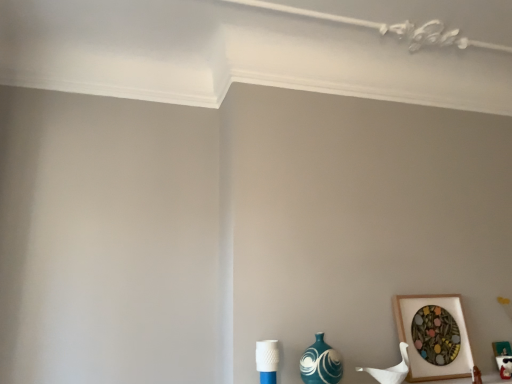
Question: From the image's perspective, is teal glossy vase at lower right located above or below wooden picture frame at lower right?

Choices:
 (A) above
 (B) below

Answer: (B)

Question: Is teal glossy vase at lower right taller or shorter than wooden picture frame at lower right?

Choices:
 (A) short
 (B) tall

Answer: (A)

Question: Is point (331, 370) closer or farther from the camera than point (409, 322)?

Choices:
 (A) closer
 (B) farther

Answer: (A)

Question: Based on their sizes in the image, would you say wooden picture frame at lower right is bigger or smaller than teal glossy vase at lower right?

Choices:
 (A) big
 (B) small

Answer: (A)

Question: From the image's perspective, is wooden picture frame at lower right above or below teal glossy vase at lower right?

Choices:
 (A) below
 (B) above

Answer: (B)

Question: From their relative heights in the image, would you say wooden picture frame at lower right is taller or shorter than teal glossy vase at lower right?

Choices:
 (A) short
 (B) tall

Answer: (B)

Question: Is wooden picture frame at lower right wider or thinner than teal glossy vase at lower right?

Choices:
 (A) thin
 (B) wide

Answer: (A)